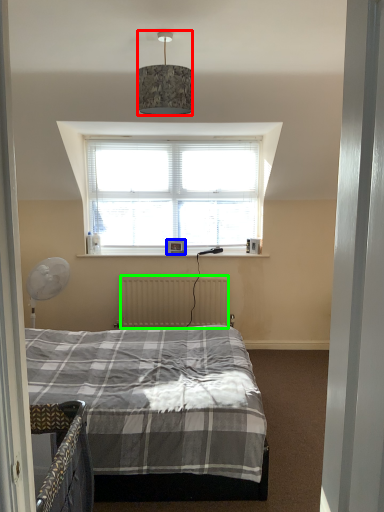
Question: Which object is the closest to the lamp (highlighted by a red box)? Choose among these: picture frame (highlighted by a blue box) or radiator (highlighted by a green box).

Choices:
 (A) picture frame
 (B) radiator

Answer: (A)